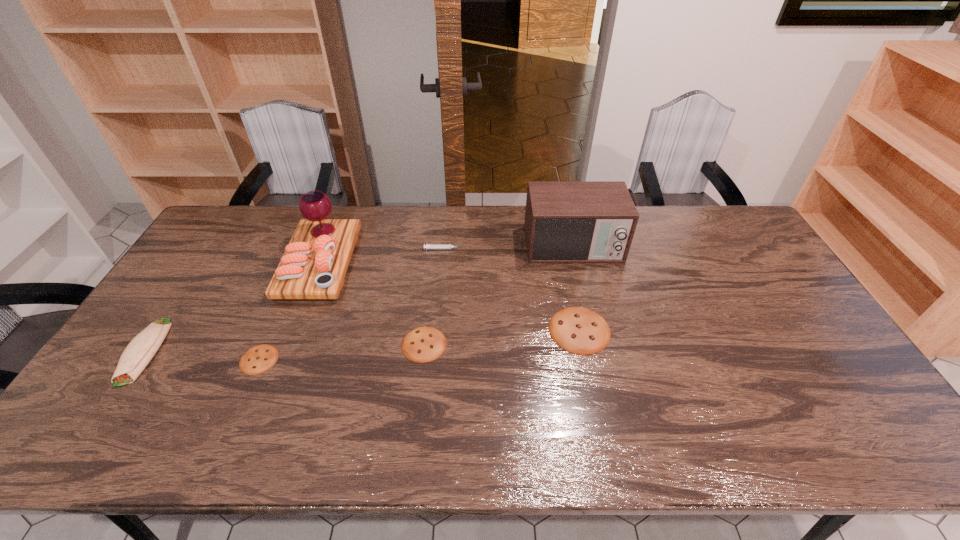
Find the location of a particular element. the leftmost cookie is located at coordinates (258, 359).

At what (x,y) coordinates should I click in order to perform the action: click on the shortest cookie. Please return your answer as a coordinate pair (x, y). The height and width of the screenshot is (540, 960). Looking at the image, I should click on (258, 359).

Where is `the sixth tallest object`? the sixth tallest object is located at coordinates (424, 344).

You are a GUI agent. You are given a task and a screenshot of the screen. Output one action in this format:
    pyautogui.click(x=<x>, y=<y>)
    Task: Click on the second cookie from right to left
    Image resolution: width=960 pixels, height=540 pixels.
    Given the screenshot: What is the action you would take?
    (x=424, y=344)

Find the location of `the tallest cookie`. the tallest cookie is located at coordinates (579, 330).

Where is `radio receiver`? The height and width of the screenshot is (540, 960). radio receiver is located at coordinates (565, 221).

Where is `platter`? platter is located at coordinates (315, 262).

Identify the location of syringe. The image size is (960, 540). (428, 246).

You are a GUI agent. You are given a task and a screenshot of the screen. Output one action in this format:
    pyautogui.click(x=<x>, y=<y>)
    Task: Click on the leftmost object
    The height and width of the screenshot is (540, 960).
    Given the screenshot: What is the action you would take?
    pyautogui.click(x=139, y=352)

Find the location of a particular element. the fifth shortest object is located at coordinates (139, 352).